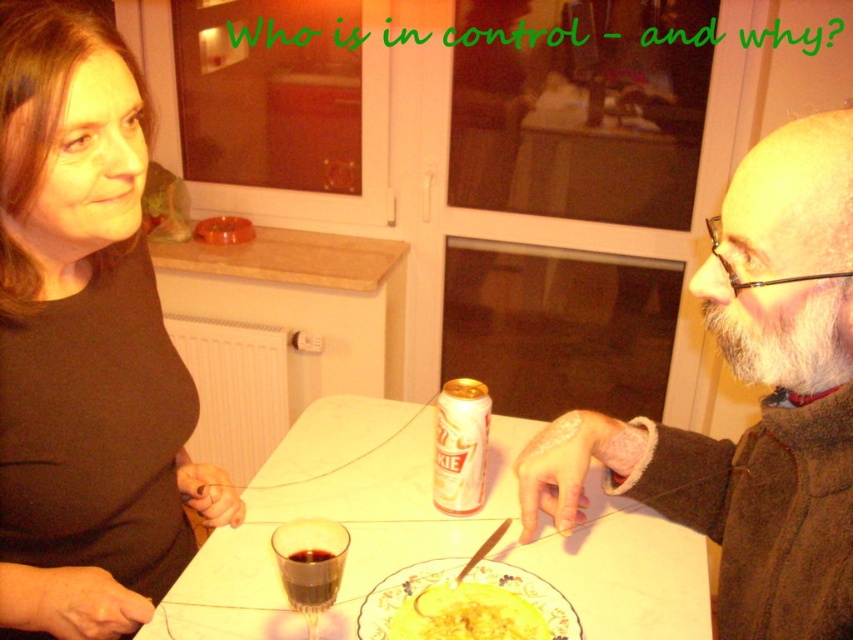
Is gray wool sweater at right smaller than dark glass at center?

Actually, gray wool sweater at right might be larger than dark glass at center.

Who is lower down, gray wool sweater at right or dark glass at center?

dark glass at center is lower down.

Is point (757, 456) farther from camera compared to point (335, 554)?

That is True.

Image resolution: width=853 pixels, height=640 pixels. In order to click on gray wool sweater at right in this screenshot , I will do `click(763, 403)`.

Does gray wool sweater at right have a greater height compared to dark glassy wine at center?

Yes, gray wool sweater at right is taller than dark glassy wine at center.

Does gray wool sweater at right have a lesser height compared to dark glassy wine at center?

No, gray wool sweater at right is not shorter than dark glassy wine at center.

Which is behind, point (825, 140) or point (317, 552)?

The point (317, 552) is more distant.

The height and width of the screenshot is (640, 853). Find the location of `gray wool sweater at right`. gray wool sweater at right is located at coordinates (763, 403).

Who is higher up, yellow matte plate at center or dark glassy wine at center?

dark glassy wine at center is above.

Based on the photo, who is positioned more to the left, yellow matte plate at center or dark glassy wine at center?

From the viewer's perspective, dark glassy wine at center appears more on the left side.

Locate an element on the screen. The image size is (853, 640). yellow matte plate at center is located at coordinates (467, 614).